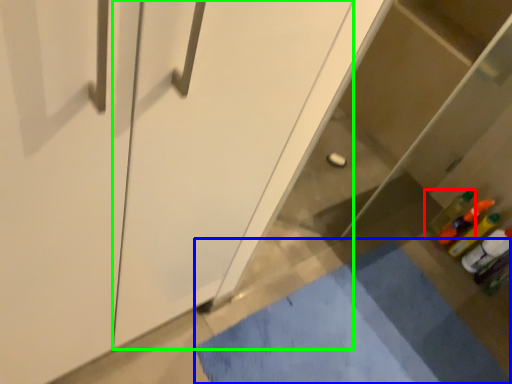
Question: Which object is positioned closest to bottle (highlighted by a red box)? Select from bath mat (highlighted by a blue box) and screen door (highlighted by a green box).

Choices:
 (A) bath mat
 (B) screen door

Answer: (A)